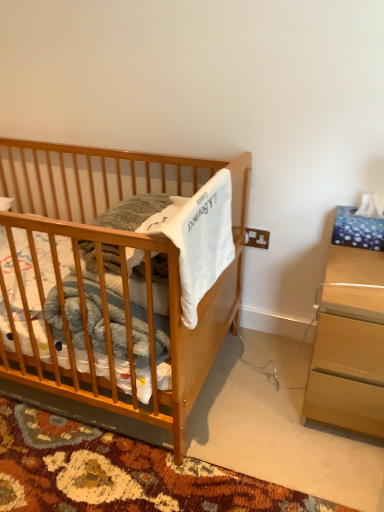
Locate an element on the screen. free point to the left of light brown wood nightstand at right is located at coordinates (255, 394).